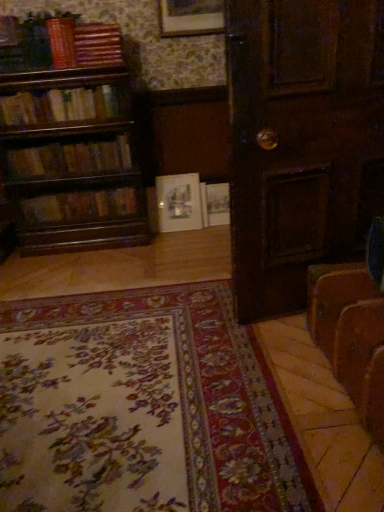
At what (x,y) coordinates should I click in order to perform the action: click on vacant space in front of white matte picture frame at center, positioned as the first picture frame in bottom-to-top order. Please return your answer as a coordinate pair (x, y). The height and width of the screenshot is (512, 384). Looking at the image, I should click on (187, 237).